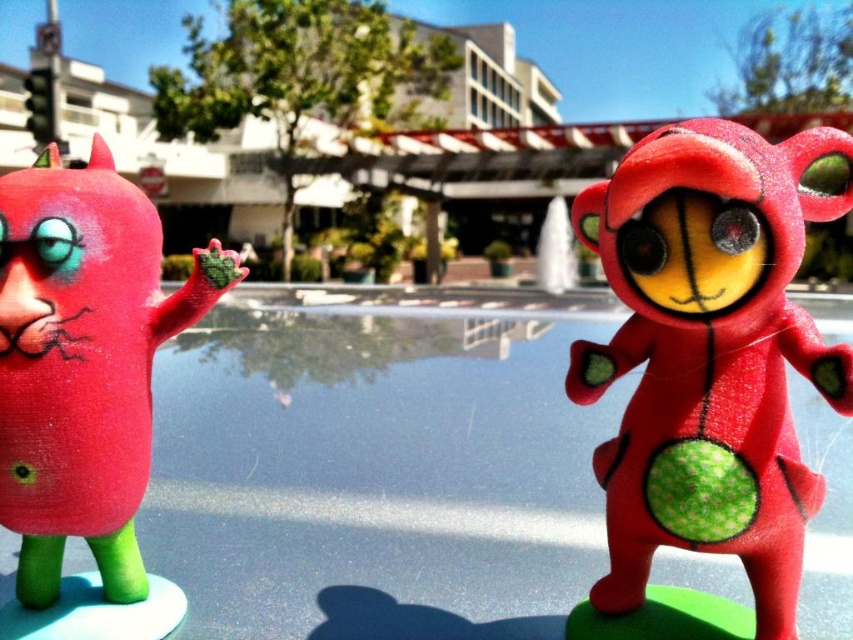
You are a delivery robot trying to place a package on the transparent glass pool at center. However, there is a matte red plush toy at right in the way. Can you move the package to the pool without touching the toy?

The transparent glass pool at center is positioned under the matte red plush toy at right, so the robot can move the package to the pool by placing it underneath the toy without touching it.